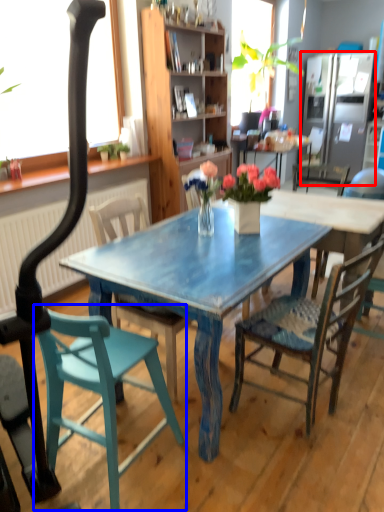
Question: Which object appears closest to the camera in this image, refrigerator (highlighted by a red box) or chair (highlighted by a blue box)?

Choices:
 (A) refrigerator
 (B) chair

Answer: (B)